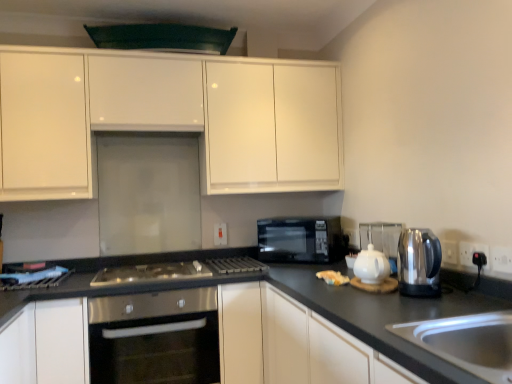
Find the location of a particular element. Image resolution: width=512 pixels, height=384 pixels. vacant space in front of stainless steel kettle at right is located at coordinates (439, 315).